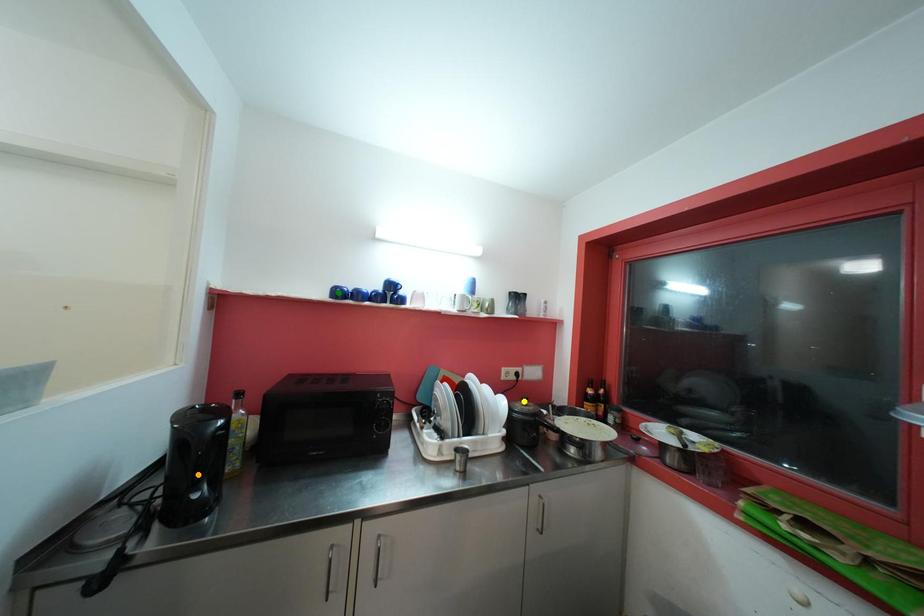
Order these from nearest to farthest:
orange point | green point | yellow point

yellow point < green point < orange point